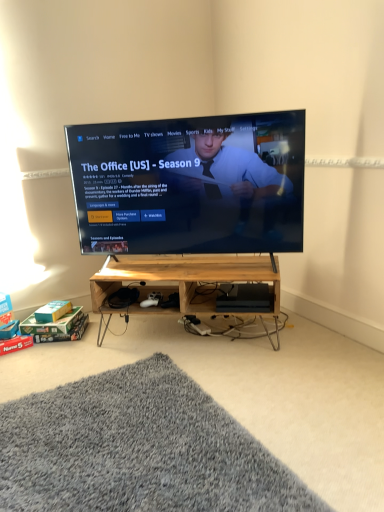
Where is `vacant region to the right of gray shaggy rug at lower left`? The width and height of the screenshot is (384, 512). vacant region to the right of gray shaggy rug at lower left is located at coordinates (309, 403).